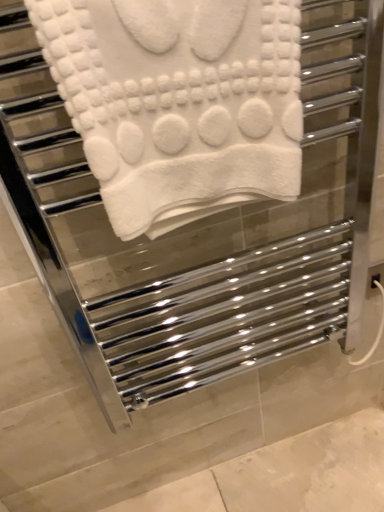
You are a GUI agent. You are given a task and a screenshot of the screen. Output one action in this format:
    pyautogui.click(x=<x>, y=<y>)
    Task: Click on the free spot below white fluffy towel at upper center (from a real-world perspective)
    This screenshot has height=512, width=384.
    Given the screenshot: What is the action you would take?
    pyautogui.click(x=260, y=495)